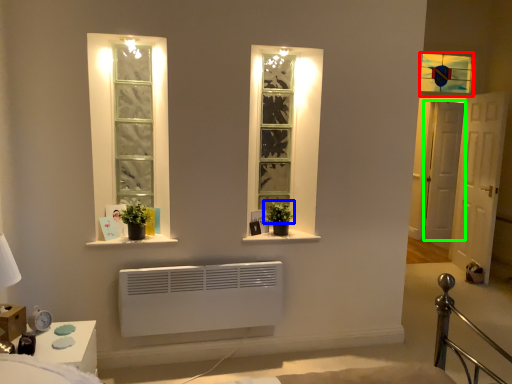
Question: Considering the real-world distances, which object is farthest from window (highlighted by a red box)? plant (highlighted by a blue box) or door (highlighted by a green box)?

Choices:
 (A) plant
 (B) door

Answer: (A)